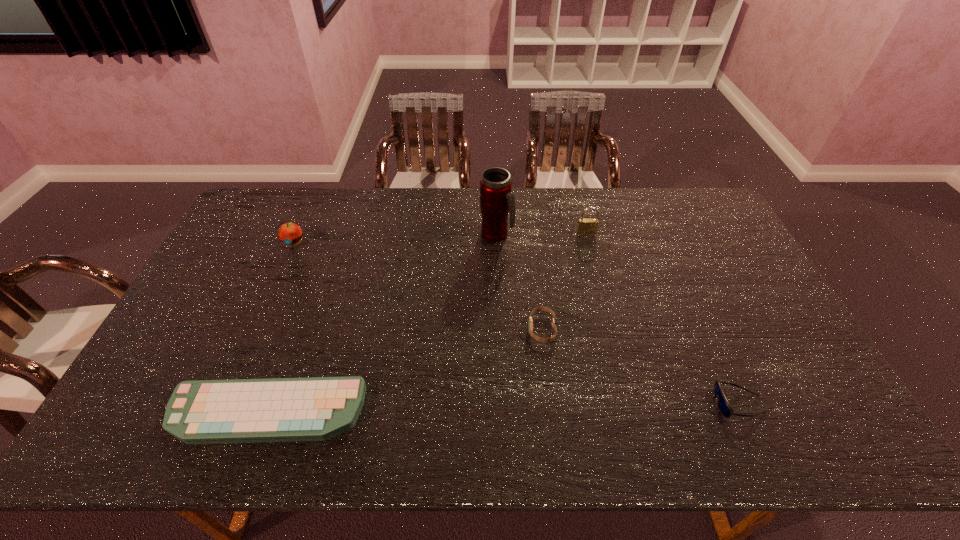
Find the location of `sunglasses positioned at the near edge`. sunglasses positioned at the near edge is located at coordinates (724, 406).

I want to click on computer keyboard that is positioned at the near edge, so click(x=318, y=408).

Locate an element on the screen. Image resolution: width=960 pixels, height=540 pixels. object present at the left edge is located at coordinates (318, 408).

I want to click on object positioned at the near left corner, so click(x=318, y=408).

Where is `vacant point at the far edge`? vacant point at the far edge is located at coordinates (601, 207).

The width and height of the screenshot is (960, 540). Identify the location of free region at the near edge of the desktop. (649, 436).

In the image, there is a desktop. Where is `vacant space at the left edge`? The image size is (960, 540). vacant space at the left edge is located at coordinates (244, 281).

You are a GUI agent. You are given a task and a screenshot of the screen. Output one action in this format:
    pyautogui.click(x=<x>, y=<y>)
    Task: Click on the free region at the right edge of the desktop
    
    Given the screenshot: What is the action you would take?
    pyautogui.click(x=730, y=325)

Identify the location of free space at the far left corner of the desktop. This screenshot has height=540, width=960. (258, 204).

Locate an element on the screen. This screenshot has height=540, width=960. vacant space at the far right corner is located at coordinates (696, 198).